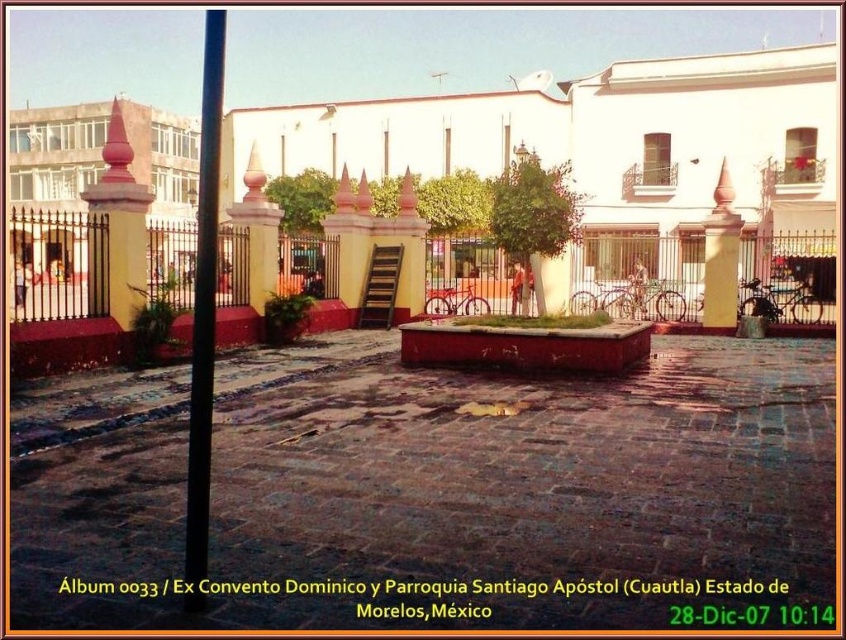
Does black smooth pole at left have a lesser width compared to red painted stone pillar at left?

No.

Can you confirm if black smooth pole at left is smaller than red painted stone pillar at left?

Actually, black smooth pole at left might be larger than red painted stone pillar at left.

Describe the element at coordinates (202, 314) in the screenshot. The height and width of the screenshot is (640, 846). I see `black smooth pole at left` at that location.

Find the location of a particular element. The width and height of the screenshot is (846, 640). black smooth pole at left is located at coordinates (202, 314).

Image resolution: width=846 pixels, height=640 pixels. What do you see at coordinates (202, 314) in the screenshot?
I see `black smooth pole at left` at bounding box center [202, 314].

Between point (207, 369) and point (704, 246), which one is positioned in front?

Point (207, 369)

Between point (215, 186) and point (731, 259), which one is positioned behind?

The point (731, 259) is more distant.

Find the location of a particular element. black smooth pole at left is located at coordinates (202, 314).

Which is behind, point (114, 230) or point (732, 237)?

The point (732, 237) is behind.

Does red painted stone pillar at left appear on the left side of yellow matte pillar at center?

Correct, you'll find red painted stone pillar at left to the left of yellow matte pillar at center.

Is point (108, 204) more distant than point (728, 285)?

No, it is in front of (728, 285).

Image resolution: width=846 pixels, height=640 pixels. Identify the location of red painted stone pillar at left. (121, 221).